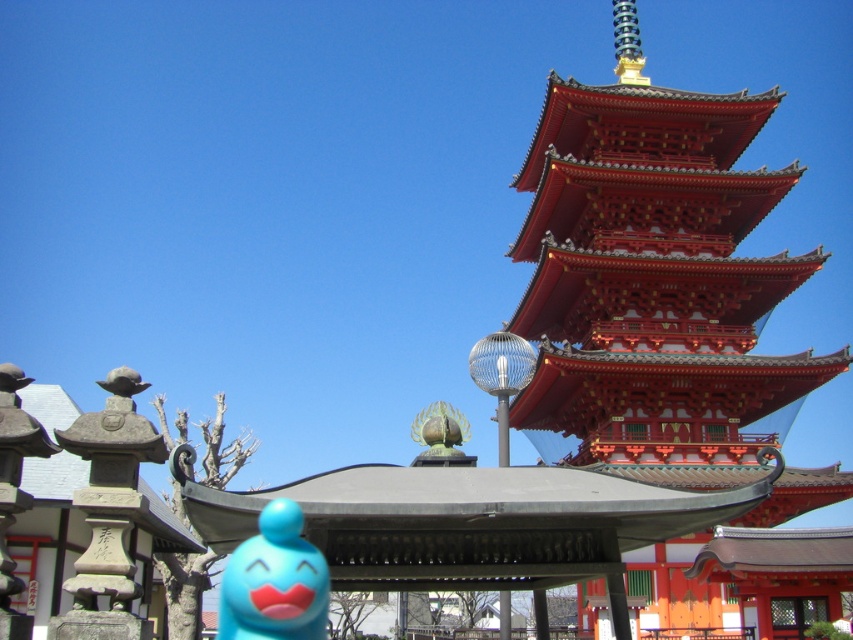
You are standing in front of the traditional Japanese pagoda and notice a shiny lacquered pagoda at upper right. Based on its position coordinates, can you determine if it is closer to the top or the bottom of the image?

The shiny lacquered pagoda at upper right is located at point (654,280), where the y coordinate 0.768 is closer to 1.0, which represents the top of the image. Therefore, it is closer to the top of the image.

You are a tour guide explaining the scale of the pagoda to visitors. You point to the matte blue toy at lower left and the green matte statue at center. How far apart are these two objects in meters?

The matte blue toy at lower left and the green matte statue at center are 16.98 meters apart from each other.

You are an architect analyzing the placement of a new statue in front of the pagoda. The pagoda is located at coordinates point (654, 280). If you want to place the statue so it aligns horizontally with the pagoda but is positioned 0.1 units to the left, what would be the new coordinate for the statue?

The new coordinate would be 0.438 minus 0.1 equals 0.338, so the coordinate is 0.338, 0.768.